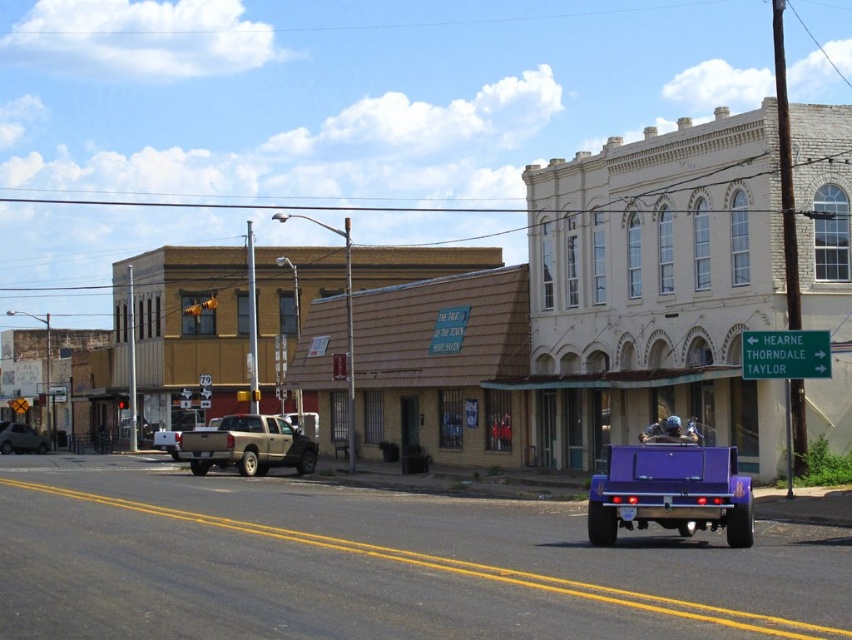
Question: Which object is closer to the camera taking this photo?

Choices:
 (A) matte black truck at center-left
 (B) gold metallic truck at center
 (C) purple plastic utility vehicle at center

Answer: (C)

Question: Is purple plastic utility vehicle at center further to camera compared to purple glossy truck at center?

Choices:
 (A) yes
 (B) no

Answer: (A)

Question: Observing the image, what is the correct spatial positioning of purple glossy truck at center in reference to matte black truck at center-left?

Choices:
 (A) right
 (B) left

Answer: (A)

Question: Considering the relative positions of gold metallic truck at center and matte black truck at center-left in the image provided, where is gold metallic truck at center located with respect to matte black truck at center-left?

Choices:
 (A) above
 (B) below

Answer: (A)

Question: Which point is farther to the camera?

Choices:
 (A) purple glossy truck at center
 (B) matte black truck at center-left
 (C) gold metallic truck at center
 (D) purple plastic utility vehicle at center

Answer: (B)

Question: Which of the following is the closest to the observer?

Choices:
 (A) purple plastic utility vehicle at center
 (B) gold metallic truck at center
 (C) matte black truck at center-left
 (D) purple glossy truck at center

Answer: (D)